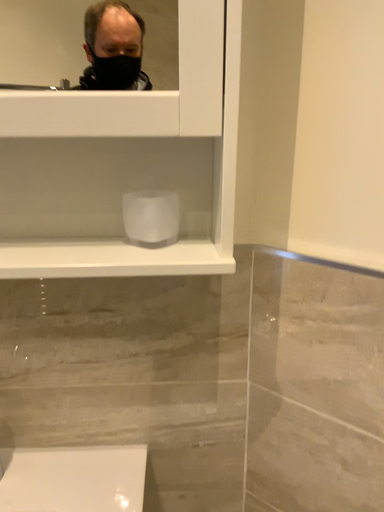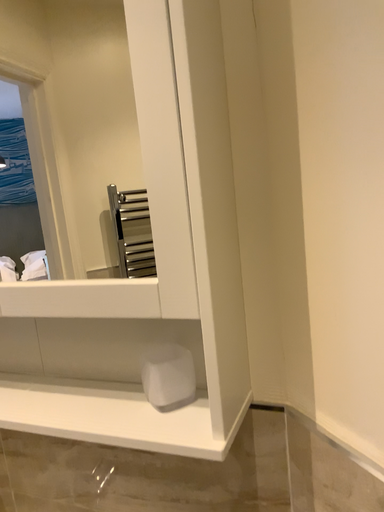
Question: How did the camera likely rotate when shooting the video?

Choices:
 (A) rotated left
 (B) rotated right

Answer: (A)